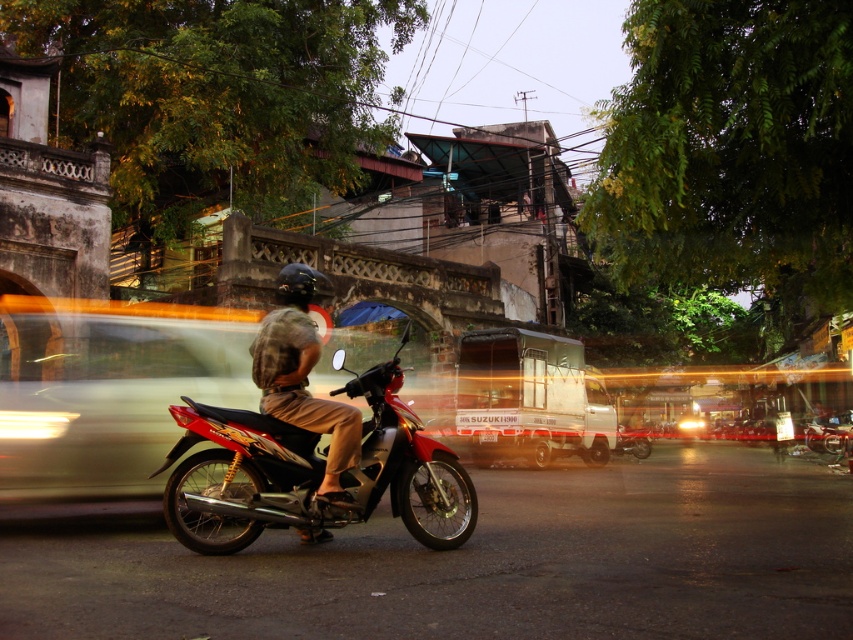
You are a pedestrian standing at the crosswalk. You see a metallic silver car at left and a shiny metallic motorcycle at center. Which vehicle is closer to you?

The metallic silver car at left is closer to you because the shiny metallic motorcycle at center is behind it.

What is located at the coordinates point (312,472)?

The shiny metallic motorcycle at center is located at point (312,472).

You are a delivery driver who needs to park your vehicle between the metallic silver car at left and the shiny metallic motorcycle at center. Given that your delivery van is 5 meters long, will there be enough space between them to fit your van?

The metallic silver car at left is larger in size than the shiny metallic motorcycle at center, but the exact distance between them is not provided. Without knowing the actual spacing between the metallic silver car at left and the shiny metallic motorcycle at center, it is impossible to determine if the 5 meter delivery van will fit.